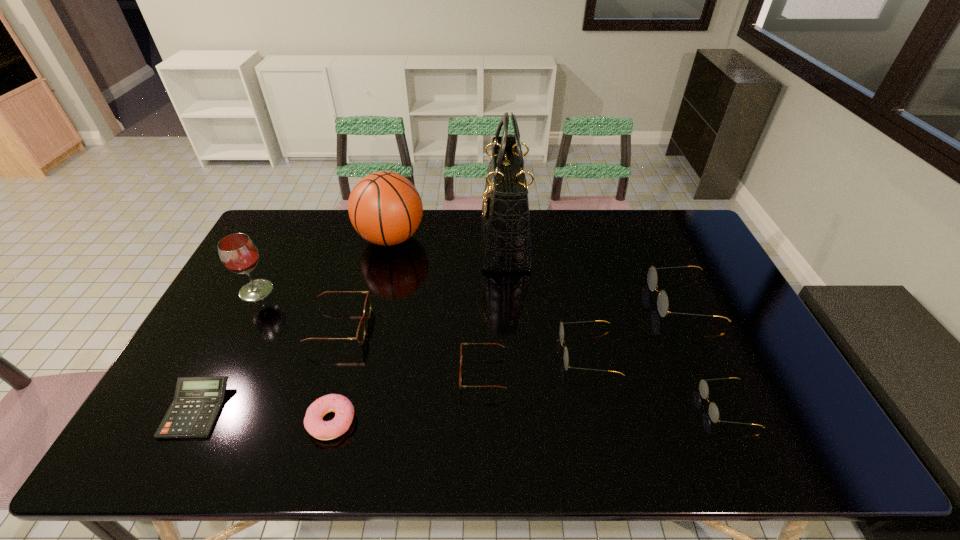
Where is `the smaller brown spectacles`? The height and width of the screenshot is (540, 960). the smaller brown spectacles is located at coordinates (461, 365).

Where is `the nearer brown spectacles`? The width and height of the screenshot is (960, 540). the nearer brown spectacles is located at coordinates (461, 365).

Where is `the smallest gold spectacles`? the smallest gold spectacles is located at coordinates (703, 386).

Image resolution: width=960 pixels, height=540 pixels. What are the coordinates of `doughnut` in the screenshot? It's located at (344, 411).

Locate an element on the screen. The image size is (960, 540). calculator is located at coordinates (197, 402).

Find the location of a particular element. vacant space located at the front of the handbag with visible charms is located at coordinates (417, 241).

This screenshot has height=540, width=960. I want to click on vacant region located at the front of the handbag with visible charms, so click(x=386, y=241).

This screenshot has height=540, width=960. In order to click on vacant space located at the front of the handbag with visible charms in this screenshot , I will do `click(448, 241)`.

At what (x,y) coordinates should I click in order to perform the action: click on vacant space located 0.360m on the right of the ninth shortest object. Please return your answer as a coordinate pair (x, y). Looking at the image, I should click on (526, 238).

Locate an element on the screen. Image resolution: width=960 pixels, height=540 pixels. vacant space located on the front of the red wineglass is located at coordinates (224, 352).